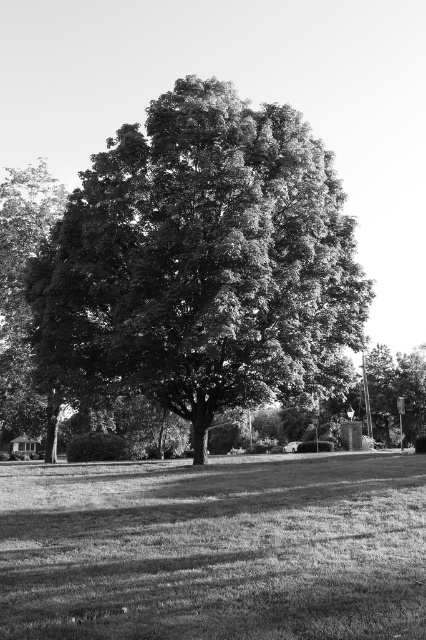
Who is taller, dark green leafy oak tree at center or grassy lawn at center?

With more height is dark green leafy oak tree at center.

Based on the photo, does dark green leafy oak tree at center appear over grassy lawn at center?

Correct, dark green leafy oak tree at center is located above grassy lawn at center.

Is point (131, 193) positioned after point (402, 497)?

Yes.

Locate an element on the screen. This screenshot has width=426, height=640. dark green leafy oak tree at center is located at coordinates (201, 260).